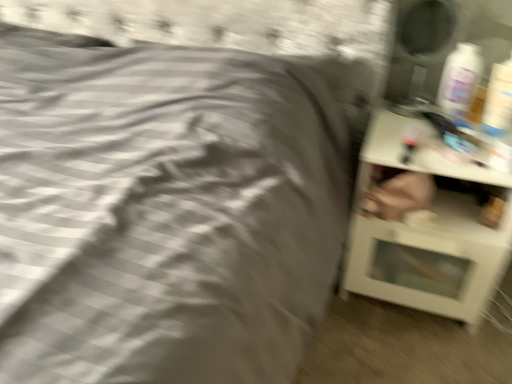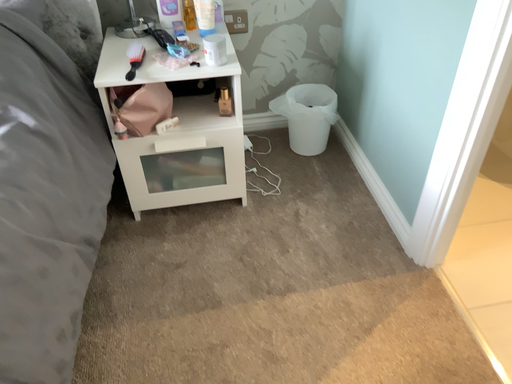
Question: Which way did the camera rotate in the video?

Choices:
 (A) rotated right
 (B) rotated left

Answer: (A)